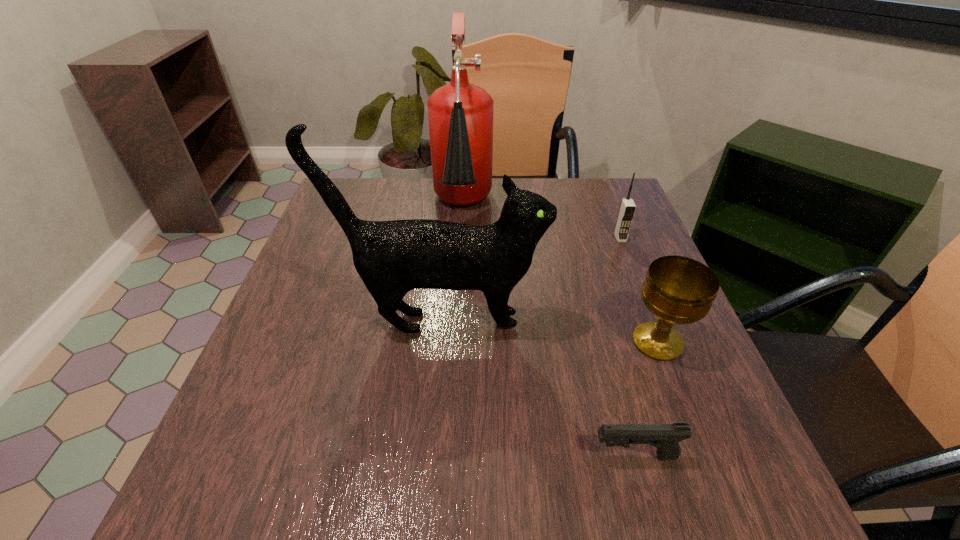
The image size is (960, 540). I want to click on free region at the far edge of the desktop, so click(432, 201).

Locate an element on the screen. vacant area at the left edge is located at coordinates (305, 286).

The image size is (960, 540). Identify the location of free space at the right edge of the desktop. (652, 320).

Where is `vacant area at the far right corner`? Image resolution: width=960 pixels, height=540 pixels. vacant area at the far right corner is located at coordinates (597, 220).

I want to click on vacant area at the near right corner, so click(659, 478).

Where is `free spot between the shortest object and the cat`? This screenshot has height=540, width=960. free spot between the shortest object and the cat is located at coordinates (538, 389).

The height and width of the screenshot is (540, 960). In order to click on vacant area that lies between the cellular telephone and the chalice in this screenshot , I will do `click(638, 290)`.

Where is `free space between the cat and the cellular telephone`? Image resolution: width=960 pixels, height=540 pixels. free space between the cat and the cellular telephone is located at coordinates click(x=531, y=280).

At what (x,y) coordinates should I click in order to perform the action: click on vacant space that is in between the nearest object and the cellular telephone. Please return your answer as a coordinate pair (x, y). This screenshot has width=960, height=540. Looking at the image, I should click on (627, 347).

Image resolution: width=960 pixels, height=540 pixels. Identify the location of free spot between the chalice and the pistol. (646, 399).